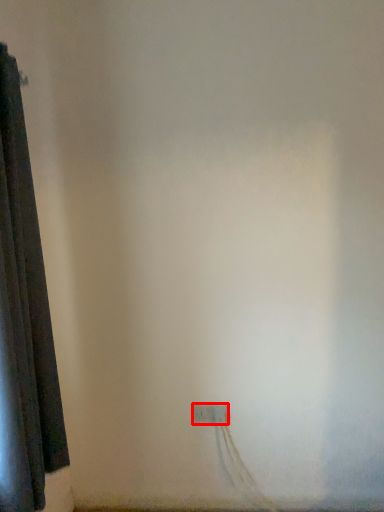
Question: From the image's perspective, what is the correct spatial positioning of power plugs and sockets (annotated by the red box) in reference to curtain?

Choices:
 (A) below
 (B) above

Answer: (A)